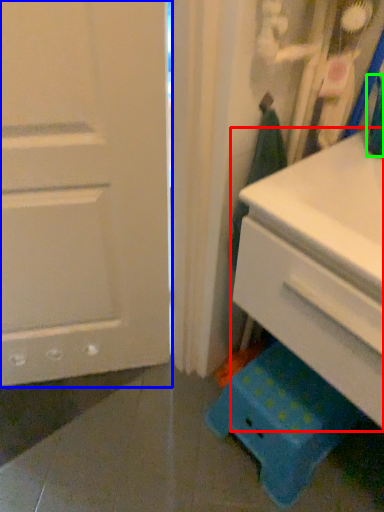
Question: Which object is positioned closest to chest of drawers (highlighted by a red box)? Select from door (highlighted by a blue box) and teal (highlighted by a green box).

Choices:
 (A) door
 (B) teal

Answer: (B)